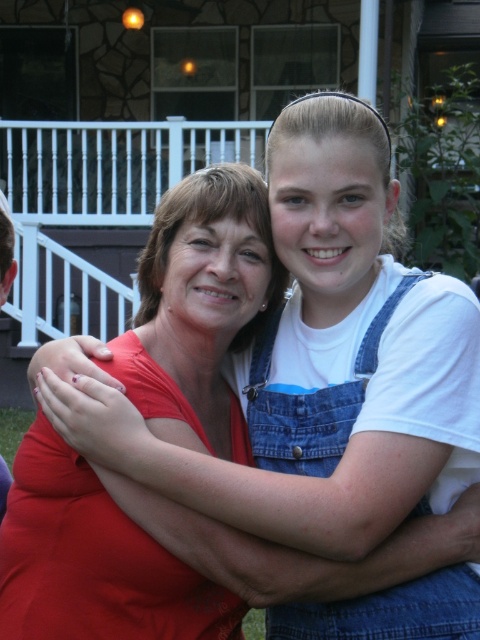
Between denim overalls at center and denim overalls at right, which one appears on the right side from the viewer's perspective?

From the viewer's perspective, denim overalls at center appears more on the right side.

Which is above, denim overalls at center or denim overalls at right?

Positioned higher is denim overalls at right.

Who is more forward, (x=434, y=586) or (x=9, y=225)?

Positioned in front is point (x=434, y=586).

Find the location of a particular element. Image resolution: width=480 pixels, height=640 pixels. denim overalls at center is located at coordinates (311, 401).

Is point (182, 604) less distant than point (6, 264)?

Yes, it is in front of point (6, 264).

Identify the location of matte red shirt at center. The image size is (480, 640). (201, 304).

Is point (23, 547) positioned in front of point (6, 493)?

Yes, it is.

Image resolution: width=480 pixels, height=640 pixels. I want to click on matte red shirt at center, so click(201, 304).

Is matte red shirt at center to the right of denim overalls at center from the viewer's perspective?

Incorrect, matte red shirt at center is not on the right side of denim overalls at center.

Describe the element at coordinates (201, 304) in the screenshot. The width and height of the screenshot is (480, 640). I see `matte red shirt at center` at that location.

Locate an element on the screen. Image resolution: width=480 pixels, height=640 pixels. matte red shirt at center is located at coordinates (201, 304).